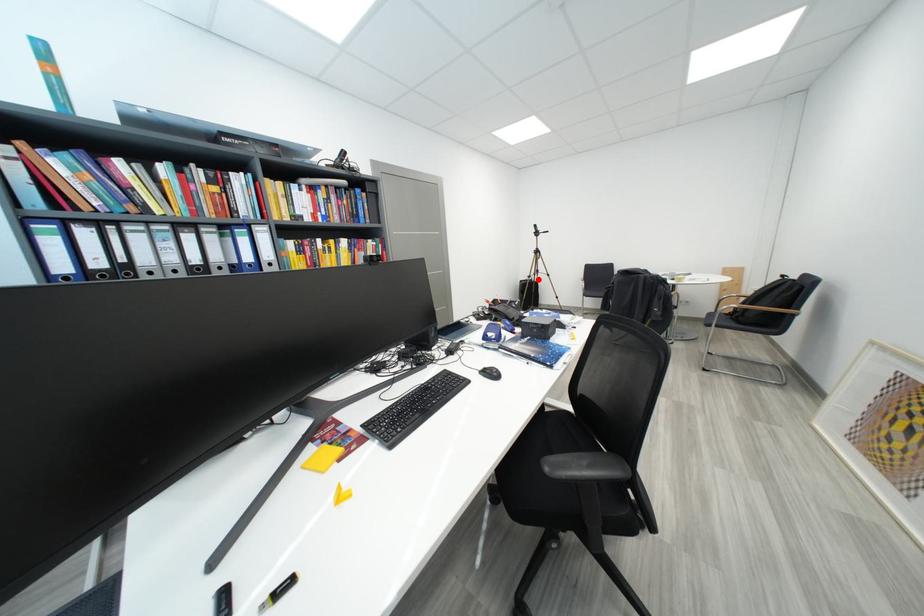
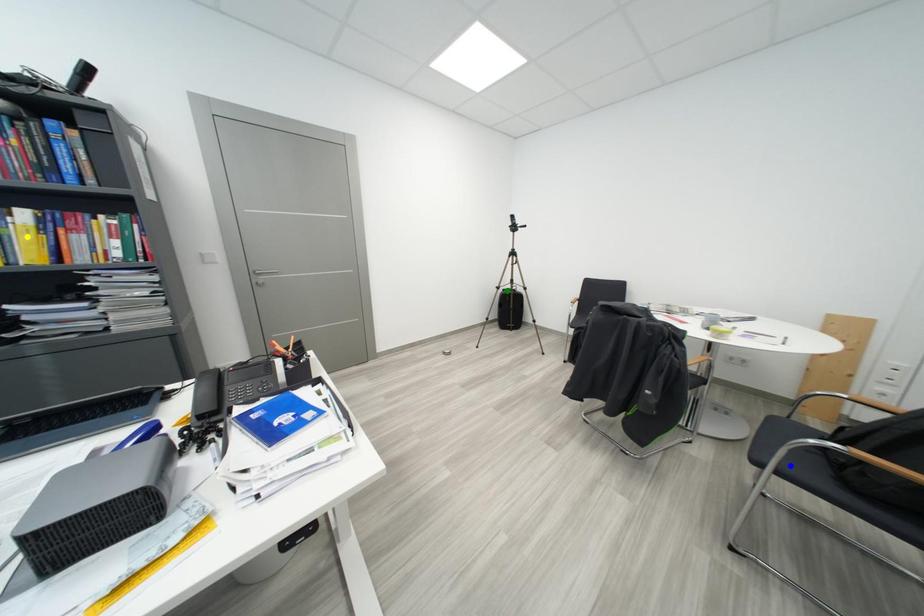
Question: I am providing you with two images of the same scene from different viewpoints. A red point is marked on the first image. You are given multiple points on the second image. Which point in image 2 represents the same 3d spot as the red point in image 1?

Choices:
 (A) blue point
 (B) yellow point
 (C) green point

Answer: (C)